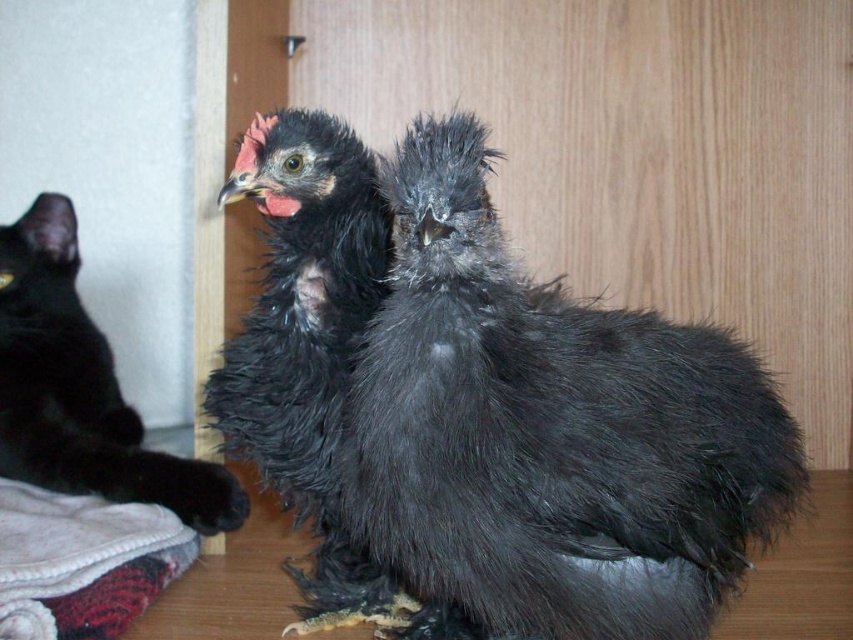
You are a photographer taking a picture of two points in the image. The first point is at coordinates point (491, 380) and the second is at point (167, 496). Which point will appear larger in your photo?

Point (491, 380) is closer to the camera than point (167, 496), so it will appear larger in the photo.

In the scene shown: You are standing in the room where the image is taken. There is a black fluffy chicken at center marked by point (308, 346). If you want to approach the chicken, which direction should you move relative to your current position?

The black fluffy chicken at center is located at point (308, 346), so you should move towards that coordinate to approach it.

You are a photographer trying to capture a photo of both the black fluffy chicken at center and the black fur cat at left. Since you want them both in the frame, can you tell me which one is closer to the left edge of the image?

The black fluffy chicken at center is positioned on the right side of black fur cat at left, so the black fur cat at left is closer to the left edge of the image.